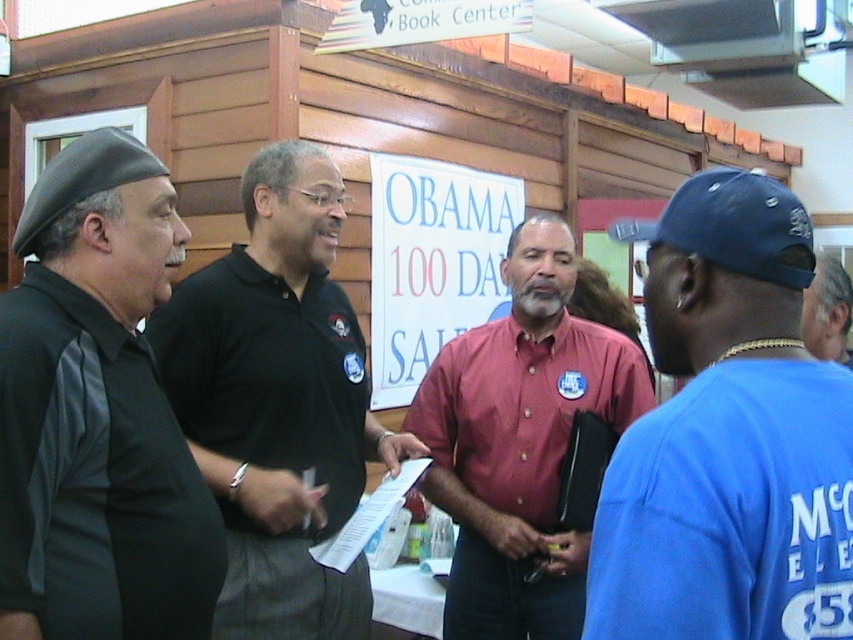
Is blue cotton polo shirt at right positioned before blue fabric cap at upper right?

Yes, blue cotton polo shirt at right is in front of blue fabric cap at upper right.

Does blue cotton polo shirt at right have a larger size compared to blue fabric cap at upper right?

Incorrect, blue cotton polo shirt at right is not larger than blue fabric cap at upper right.

Locate an element on the screen. This screenshot has width=853, height=640. blue cotton polo shirt at right is located at coordinates (730, 509).

You are a GUI agent. You are given a task and a screenshot of the screen. Output one action in this format:
    pyautogui.click(x=<x>, y=<y>)
    Task: Click on the blue cotton polo shirt at right
    This screenshot has width=853, height=640.
    Given the screenshot: What is the action you would take?
    pyautogui.click(x=730, y=509)

Which is below, blue cotton polo shirt at right or blue fabric baseball cap at right?

Positioned lower is blue cotton polo shirt at right.

Is point (616, 488) behind point (805, 230)?

That is False.

Is point (842, 621) positioned before point (788, 195)?

Yes.

Find the location of a particular element. Image resolution: width=853 pixels, height=640 pixels. blue cotton polo shirt at right is located at coordinates (730, 509).

Between black polo shirt at center and blue fabric baseball cap at right, which one has more height?

Standing taller between the two is black polo shirt at center.

Can you confirm if black polo shirt at center is positioned to the right of blue fabric baseball cap at right?

No, black polo shirt at center is not to the right of blue fabric baseball cap at right.

Measure the distance between point (360, 401) and camera.

A distance of 2.60 meters exists between point (360, 401) and camera.

You are a GUI agent. You are given a task and a screenshot of the screen. Output one action in this format:
    pyautogui.click(x=<x>, y=<y>)
    Task: Click on the black polo shirt at center
    This screenshot has width=853, height=640.
    Given the screenshot: What is the action you would take?
    pyautogui.click(x=277, y=401)